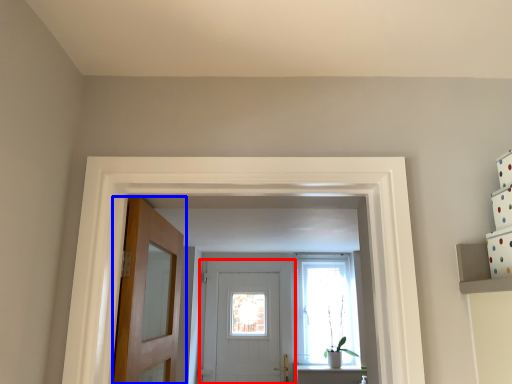
Question: Which object appears closest to the camera in this image, door (highlighted by a red box) or door (highlighted by a blue box)?

Choices:
 (A) door
 (B) door

Answer: (B)